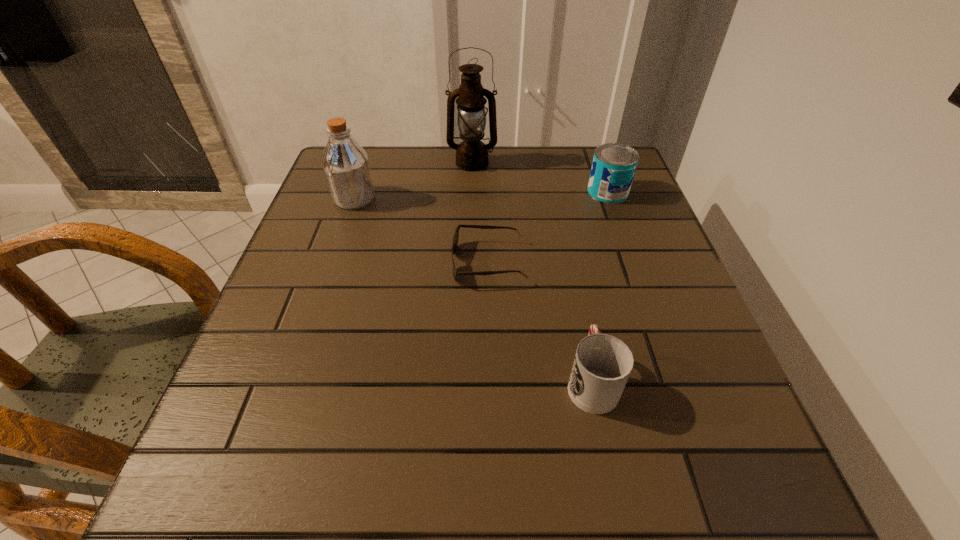
Identify the location of free location located on the right of the bottle. (456, 198).

Image resolution: width=960 pixels, height=540 pixels. What are the coordinates of `vacant area situated 0.400m on the front of the can` in the screenshot? It's located at (659, 334).

The height and width of the screenshot is (540, 960). I want to click on free location located 0.100m on the side of the cup where the handle is located, so click(x=577, y=308).

In order to click on vacant region located on the side of the cup where the handle is located in this screenshot , I will do [559, 219].

Identify the location of free space located on the side of the cup where the handle is located. (577, 312).

This screenshot has width=960, height=540. What are the coordinates of `vacant space located on the lenses of the sunglasses` in the screenshot? It's located at (x=372, y=262).

At what (x,y) coordinates should I click in order to perform the action: click on free spot located 0.230m on the lenses of the sunglasses. Please return your answer as a coordinate pair (x, y). The width and height of the screenshot is (960, 540). Looking at the image, I should click on (344, 262).

Image resolution: width=960 pixels, height=540 pixels. Find the location of `vacant space located 0.160m on the lenses of the sunglasses`. vacant space located 0.160m on the lenses of the sunglasses is located at coordinates (377, 262).

Find the location of `oil lamp at the far edge`. oil lamp at the far edge is located at coordinates (471, 154).

Locate an element on the screen. The height and width of the screenshot is (540, 960). bottle positioned at the far edge is located at coordinates (346, 166).